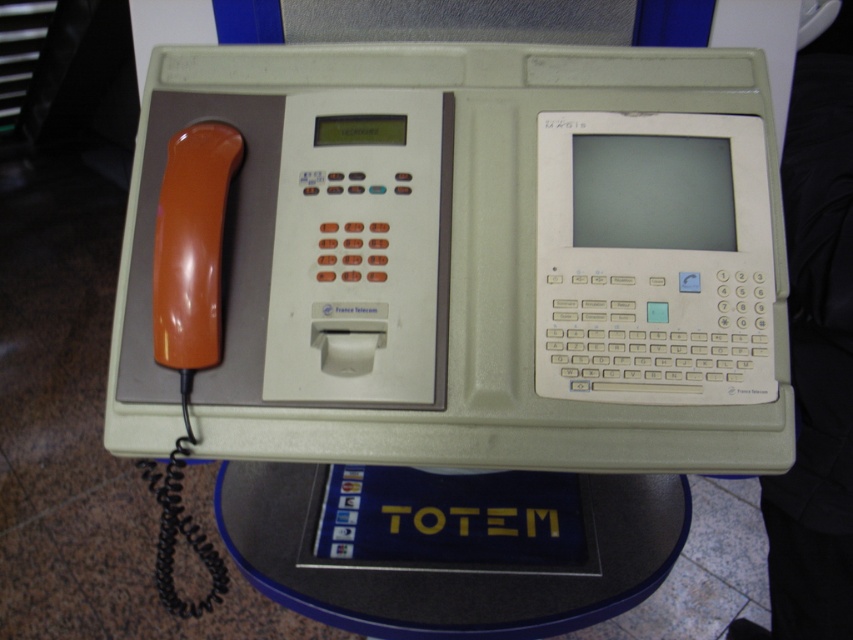
Question: Is matte gray phone box at center below blue plastic round table at center?

Choices:
 (A) yes
 (B) no

Answer: (B)

Question: Which of the following is the closest to the observer?

Choices:
 (A) blue plastic round table at center
 (B) matte gray phone box at center

Answer: (B)

Question: Which of the following is the farthest from the observer?

Choices:
 (A) matte gray phone box at center
 (B) blue plastic round table at center

Answer: (B)

Question: Is matte gray phone box at center closer to the viewer compared to blue plastic round table at center?

Choices:
 (A) no
 (B) yes

Answer: (B)

Question: Is the position of matte gray phone box at center more distant than that of blue plastic round table at center?

Choices:
 (A) no
 (B) yes

Answer: (A)